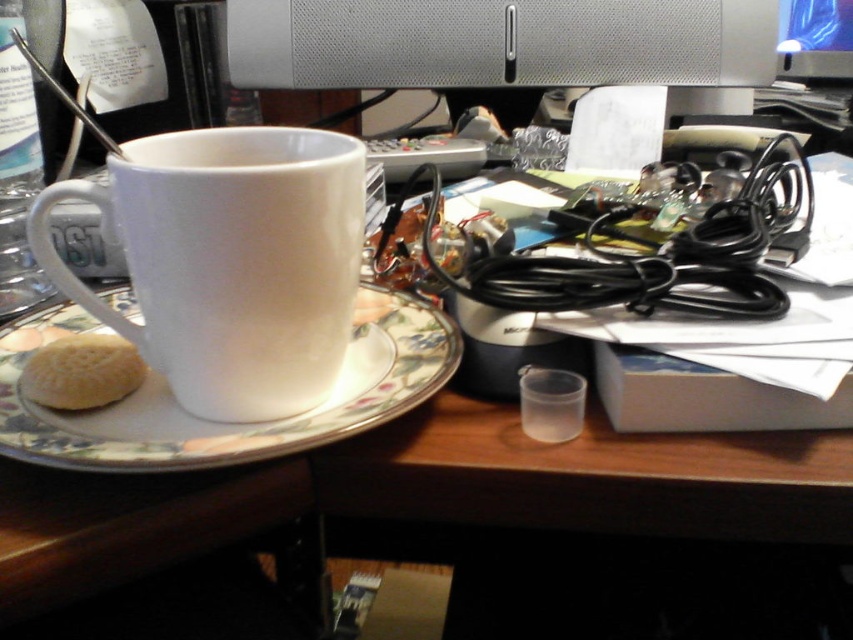
Question: Which object is positioned closest to the satin silver computer monitor at upper center?

Choices:
 (A) white matte biscuit at lower left
 (B) porcelain saucer at center

Answer: (B)

Question: Does white matte mug at center have a smaller size compared to white matte biscuit at lower left?

Choices:
 (A) no
 (B) yes

Answer: (A)

Question: Does porcelain saucer at center appear over satin silver computer monitor at upper center?

Choices:
 (A) yes
 (B) no

Answer: (B)

Question: Does white matte mug at center appear under porcelain saucer at center?

Choices:
 (A) no
 (B) yes

Answer: (A)

Question: Which point is closer to the camera?

Choices:
 (A) white matte biscuit at lower left
 (B) white matte mug at center
 (C) porcelain saucer at center

Answer: (C)

Question: Which point is closer to the camera taking this photo?

Choices:
 (A) (399, 324)
 (B) (839, 60)
 (C) (260, 240)

Answer: (C)